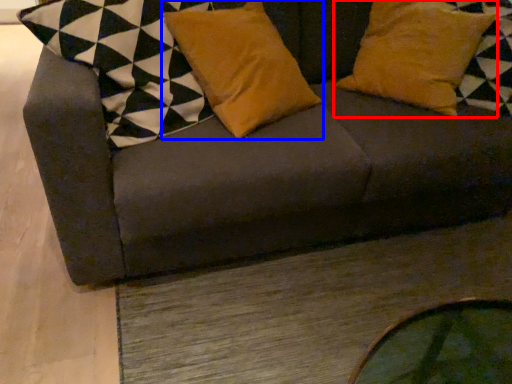
Question: Among these objects, which one is farthest to the camera, pillow (highlighted by a red box) or pillow (highlighted by a blue box)?

Choices:
 (A) pillow
 (B) pillow

Answer: (A)